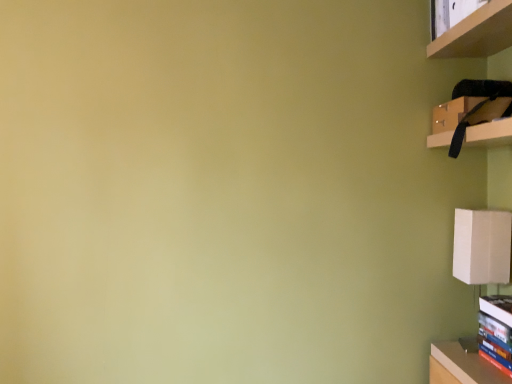
Question: Considering the relative sizes of matte black cabinet at upper right and hardcover book at lower right in the image provided, is matte black cabinet at upper right thinner than hardcover book at lower right?

Choices:
 (A) yes
 (B) no

Answer: (B)

Question: Are matte black cabinet at upper right and hardcover book at lower right located far from each other?

Choices:
 (A) no
 (B) yes

Answer: (A)

Question: Does matte black cabinet at upper right turn towards hardcover book at lower right?

Choices:
 (A) yes
 (B) no

Answer: (B)

Question: Considering the relative sizes of matte black cabinet at upper right and hardcover book at lower right in the image provided, is matte black cabinet at upper right bigger than hardcover book at lower right?

Choices:
 (A) no
 (B) yes

Answer: (B)

Question: From a real-world perspective, is matte black cabinet at upper right physically above hardcover book at lower right?

Choices:
 (A) no
 (B) yes

Answer: (B)

Question: Is matte black cabinet at upper right taller than hardcover book at lower right?

Choices:
 (A) yes
 (B) no

Answer: (B)

Question: Does hardcover book at lower right touch matte black cabinet at upper right?

Choices:
 (A) yes
 (B) no

Answer: (B)

Question: Does hardcover book at lower right have a smaller size compared to matte black cabinet at upper right?

Choices:
 (A) yes
 (B) no

Answer: (A)

Question: Considering the relative sizes of hardcover book at lower right and matte black cabinet at upper right in the image provided, is hardcover book at lower right taller than matte black cabinet at upper right?

Choices:
 (A) yes
 (B) no

Answer: (A)

Question: From a real-world perspective, is hardcover book at lower right positioned over matte black cabinet at upper right based on gravity?

Choices:
 (A) yes
 (B) no

Answer: (B)

Question: From a real-world perspective, does hardcover book at lower right sit lower than matte black cabinet at upper right?

Choices:
 (A) no
 (B) yes

Answer: (B)

Question: Can you confirm if hardcover book at lower right is positioned to the left of matte black cabinet at upper right?

Choices:
 (A) no
 (B) yes

Answer: (A)

Question: Does hardcover book at lower right have a greater width compared to wooden shelf at upper right?

Choices:
 (A) yes
 (B) no

Answer: (B)